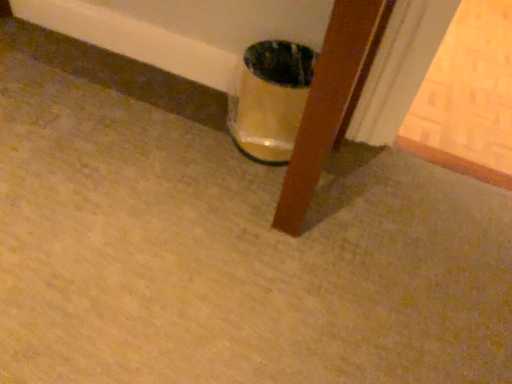
This screenshot has height=384, width=512. Describe the element at coordinates (270, 99) in the screenshot. I see `clear plastic can at center` at that location.

Identify the location of clear plastic can at center. Image resolution: width=512 pixels, height=384 pixels. (270, 99).

What is the approximate width of clear plastic can at center?

clear plastic can at center is 27.74 centimeters wide.

At what (x,y) coordinates should I click in order to perform the action: click on clear plastic can at center. Please return your answer as a coordinate pair (x, y). This screenshot has width=512, height=384. Looking at the image, I should click on (270, 99).